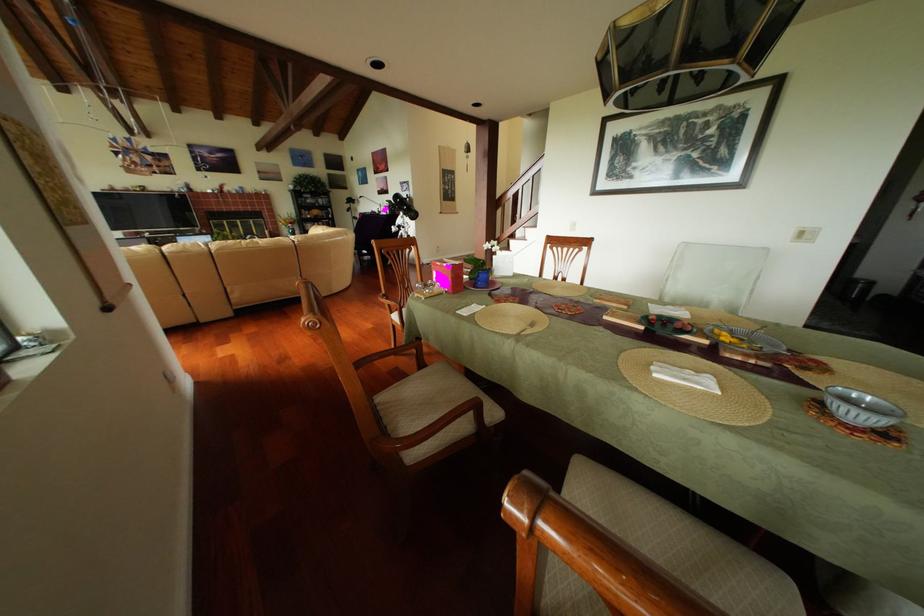
Find where to lift the metal fork. Please return your answer as a coordinate pair (x, y).

(736, 331)